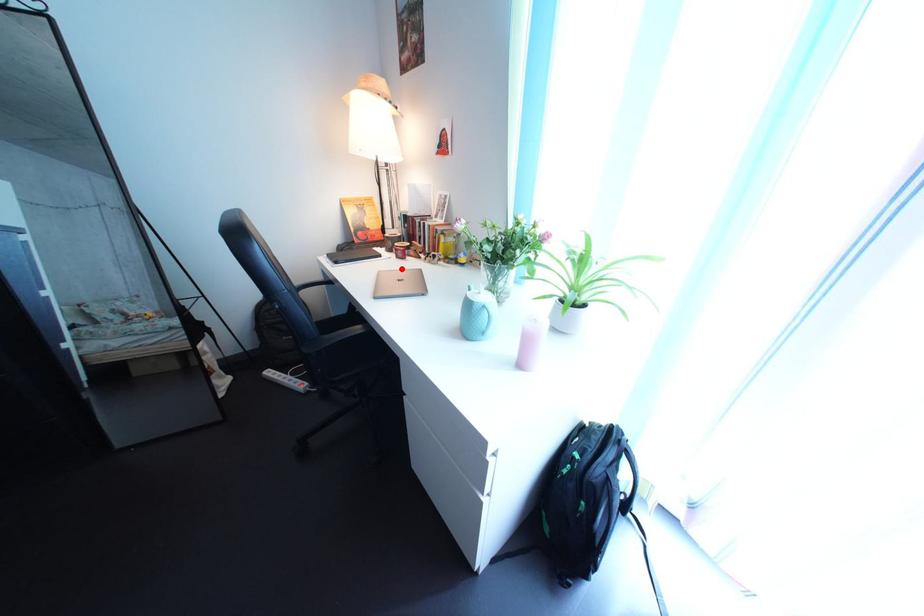
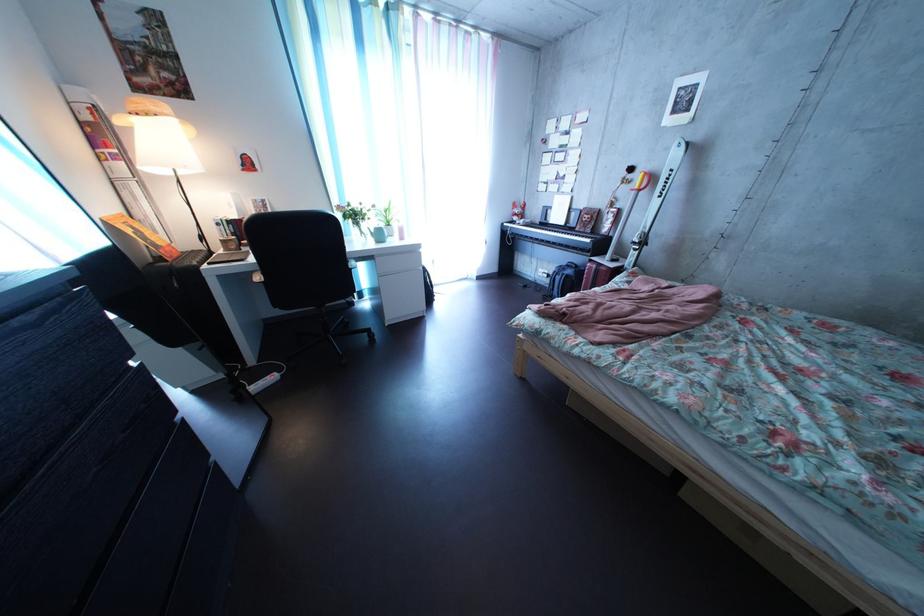
Question: I am providing you with two images of the same scene from different viewpoints. A red point is marked on the first image. At the location where the point appears in image 1, is it still visible in image 2?

Choices:
 (A) Yes
 (B) No

Answer: (B)